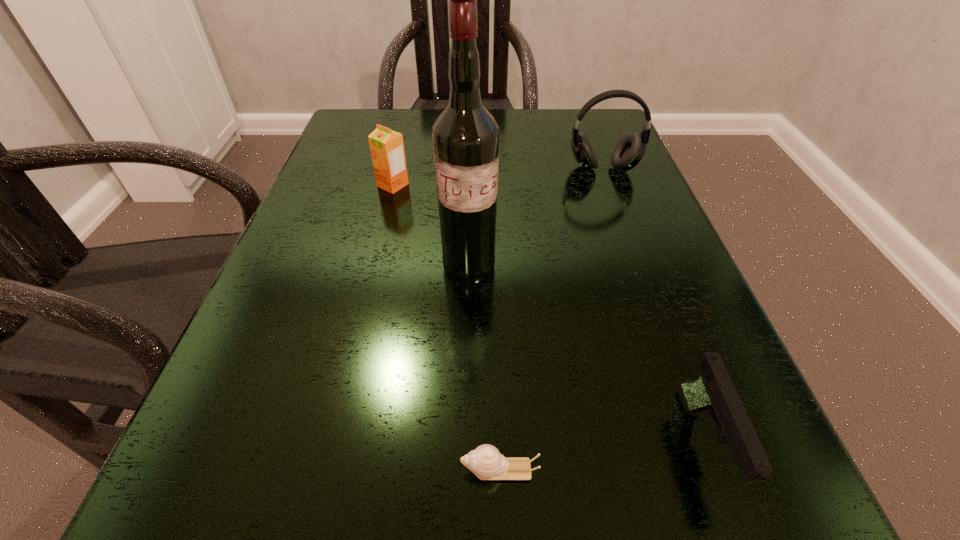
What are the coordinates of `the tallest object` in the screenshot? It's located at (465, 136).

You are a GUI agent. You are given a task and a screenshot of the screen. Output one action in this format:
    pyautogui.click(x=<x>, y=<y>)
    Task: Click on the third farthest object
    
    Given the screenshot: What is the action you would take?
    pyautogui.click(x=465, y=136)

Where is `headset`? This screenshot has height=540, width=960. headset is located at coordinates coord(630,150).

Find the location of a particular element. the third tallest object is located at coordinates (387, 149).

Find the location of a particular element. orange juice is located at coordinates (387, 149).

Identify the location of the fourth tallest object. (713, 392).

At what (x,y) coordinates should I click in order to perform the action: click on the shortest object. Please return your answer as a coordinate pair (x, y). Looking at the image, I should click on (486, 462).

Where is `free space located on the front and back of the third farthest object`? free space located on the front and back of the third farthest object is located at coordinates (467, 352).

You are a GUI agent. You are given a task and a screenshot of the screen. Output one action in this format:
    pyautogui.click(x=<x>, y=<y>)
    Task: Click on the vacant space located on the ear cups of the second tallest object
    This screenshot has height=540, width=960.
    Given the screenshot: What is the action you would take?
    pyautogui.click(x=661, y=325)

Where is `vacant region located 0.190m on the right of the leftmost object`? vacant region located 0.190m on the right of the leftmost object is located at coordinates point(506,185).